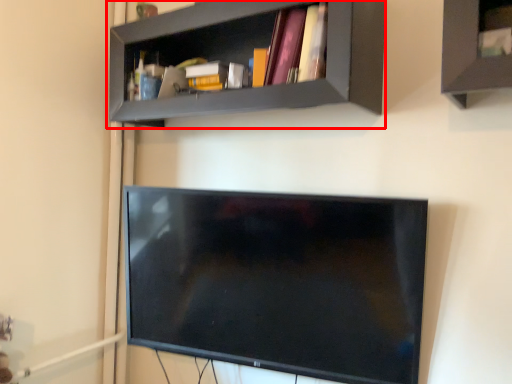
Question: Considering the relative positions of shelf (annotated by the red box) and book in the image provided, where is shelf (annotated by the red box) located with respect to the staircase?

Choices:
 (A) left
 (B) right

Answer: (A)